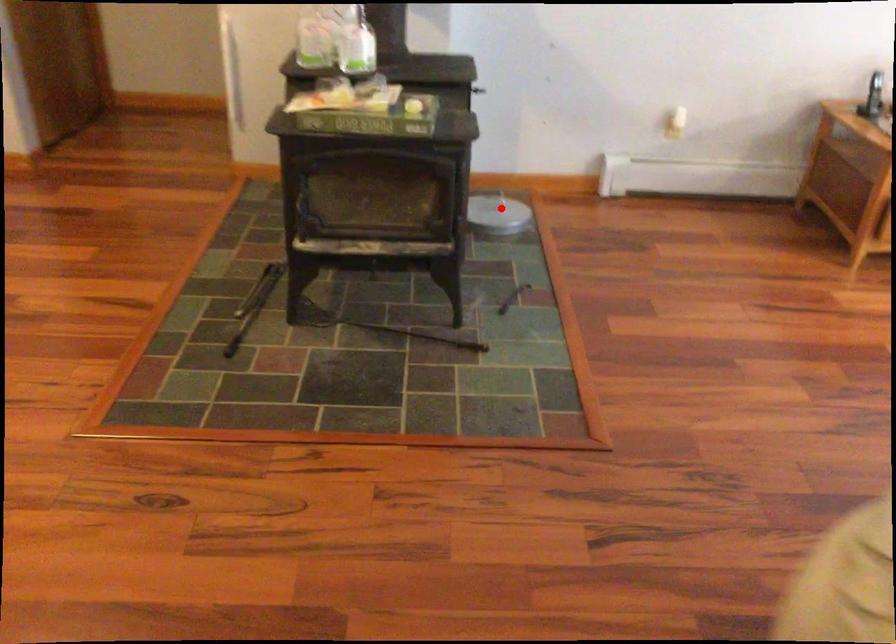
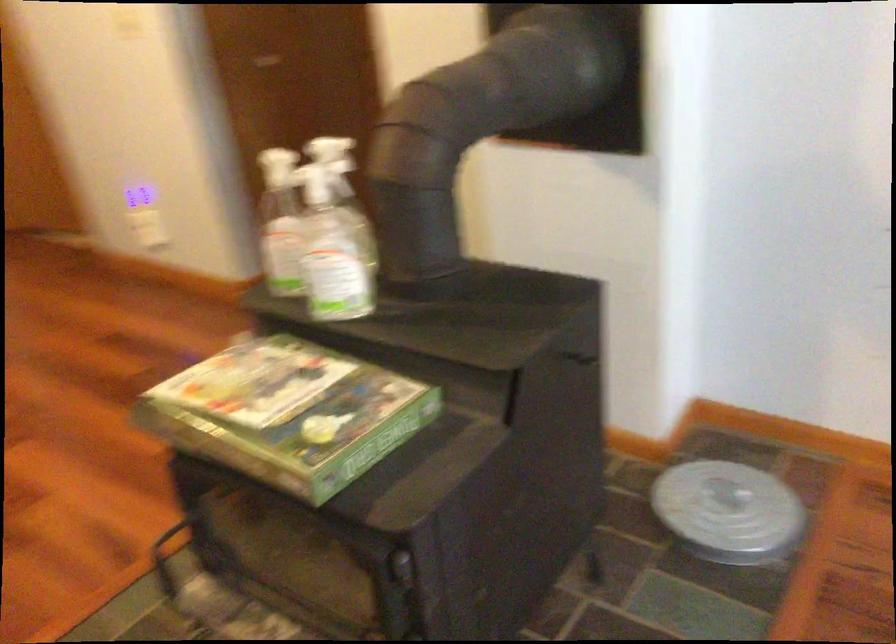
Where in the second image is the point corresponding to the highlighted location from the first image?

(728, 512)